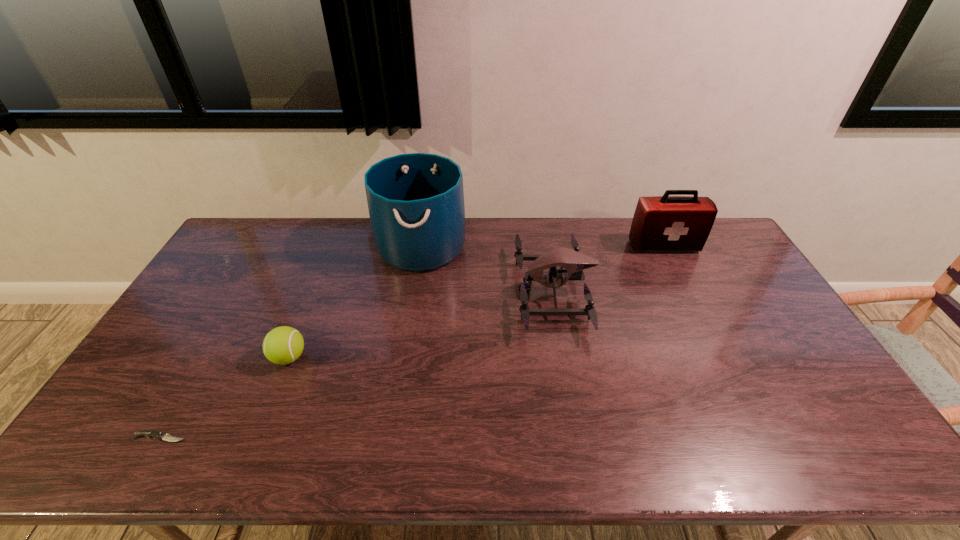
This screenshot has width=960, height=540. In order to click on object at the near edge in this screenshot , I will do `click(149, 433)`.

This screenshot has height=540, width=960. Find the location of `object located at the left edge`. object located at the left edge is located at coordinates (149, 433).

This screenshot has width=960, height=540. In order to click on object that is at the right edge in this screenshot , I will do pyautogui.click(x=665, y=223).

You are a GUI agent. You are given a task and a screenshot of the screen. Output one action in this format:
    pyautogui.click(x=<x>, y=<y>)
    Task: Click on the object present at the near left corner
    This screenshot has height=540, width=960.
    Given the screenshot: What is the action you would take?
    pyautogui.click(x=149, y=433)

Find the location of a particular element. object at the far right corner is located at coordinates (x=665, y=223).

You are a GUI agent. You are given a task and a screenshot of the screen. Output one action in this format:
    pyautogui.click(x=<x>, y=<y>)
    Task: Click on the free spot at the far edge of the desktop
    The image size is (960, 540).
    Given the screenshot: What is the action you would take?
    pyautogui.click(x=570, y=243)

The height and width of the screenshot is (540, 960). In the image, there is a desktop. What are the coordinates of `vacant space at the near edge` in the screenshot? It's located at (270, 450).

The width and height of the screenshot is (960, 540). Identify the location of vacant area at the left edge. (152, 354).

Identify the location of free location at the right edge. (792, 415).

Where is `free space between the third tallest object and the pocketknife`? This screenshot has width=960, height=540. free space between the third tallest object and the pocketknife is located at coordinates (357, 364).